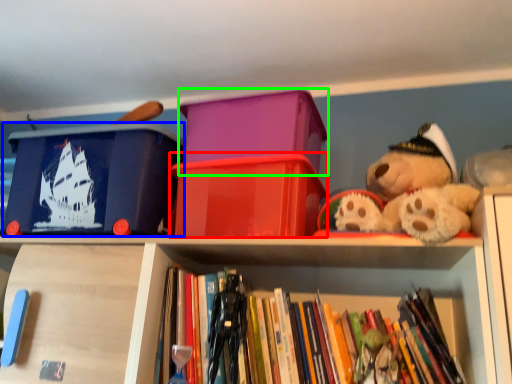
Question: Which is farther away from storage box (highlighted by a red box)? storage box (highlighted by a blue box) or storage box (highlighted by a green box)?

Choices:
 (A) storage box
 (B) storage box

Answer: (A)